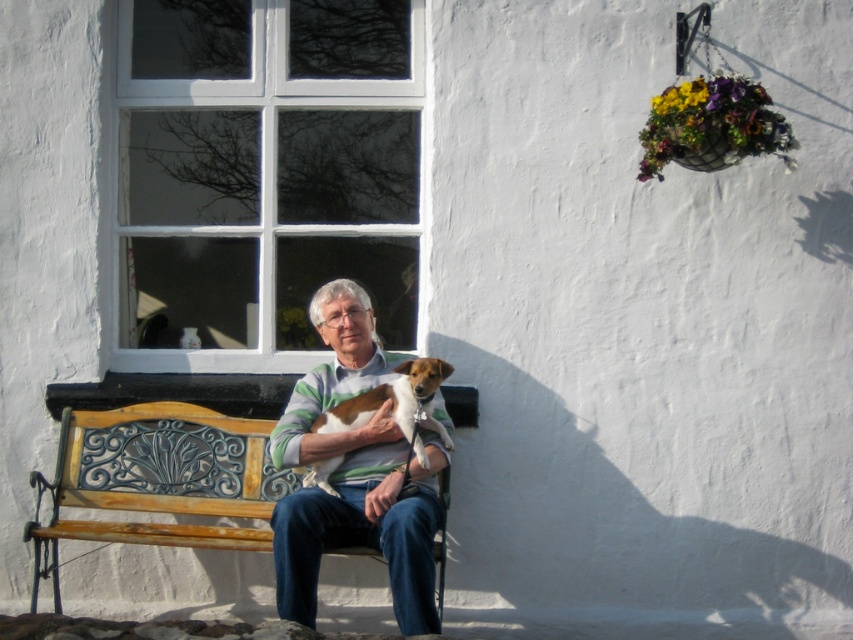
Question: Which object is farther from the camera taking this photo?

Choices:
 (A) wooden bench at center
 (B) brown and white fur at center
 (C) striped sweater at center

Answer: (A)

Question: Which of the following is the closest to the observer?

Choices:
 (A) wooden bench at center
 (B) brown and white fur at center
 (C) striped sweater at center

Answer: (C)

Question: Can you confirm if wooden bench at center is smaller than brown and white fur at center?

Choices:
 (A) no
 (B) yes

Answer: (A)

Question: Which of these objects is positioned closest to the wooden bench at center?

Choices:
 (A) striped sweater at center
 (B) brown and white fur at center

Answer: (A)

Question: From the image, what is the correct spatial relationship of striped sweater at center in relation to brown and white fur at center?

Choices:
 (A) right
 (B) left

Answer: (B)

Question: Does wooden bench at center appear on the left side of brown and white fur at center?

Choices:
 (A) yes
 (B) no

Answer: (A)